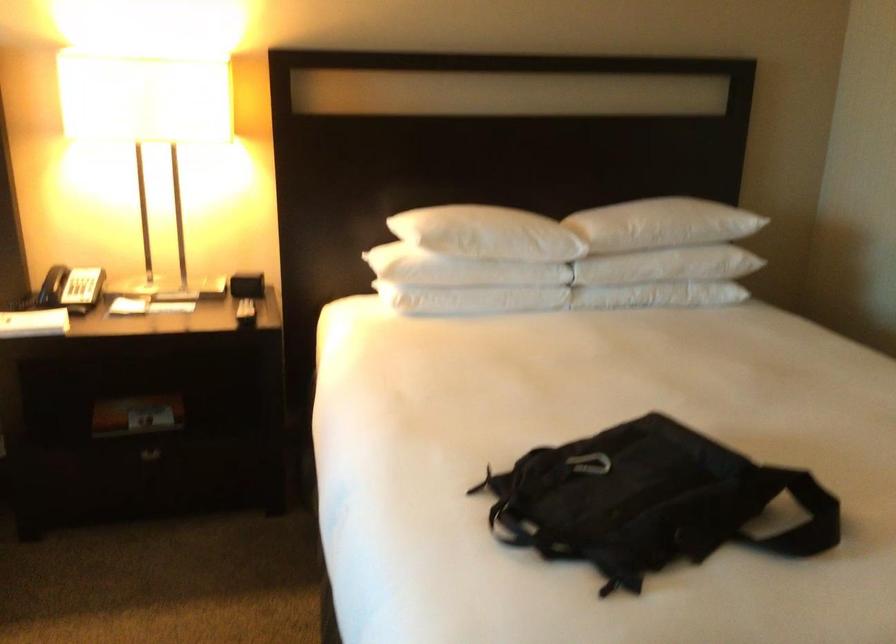
Identify the location of drawer handle. The width and height of the screenshot is (896, 644). [x=151, y=456].